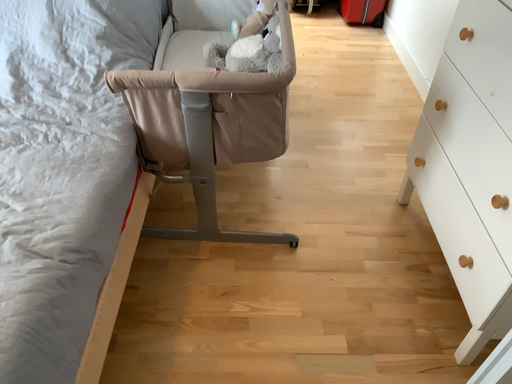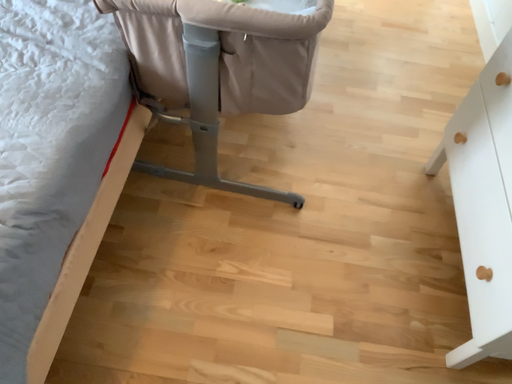
Question: Which way did the camera rotate in the video?

Choices:
 (A) rotated downward
 (B) rotated upward

Answer: (A)